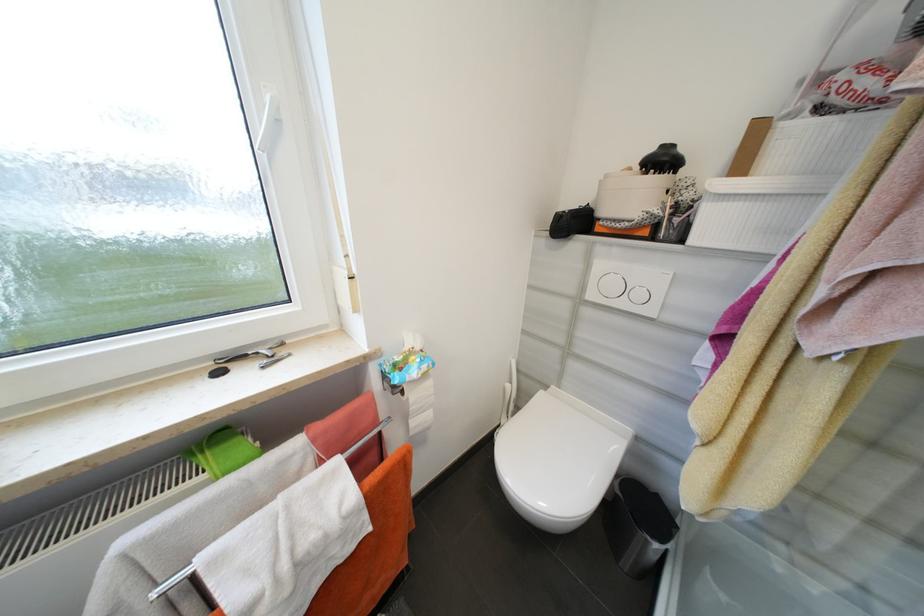
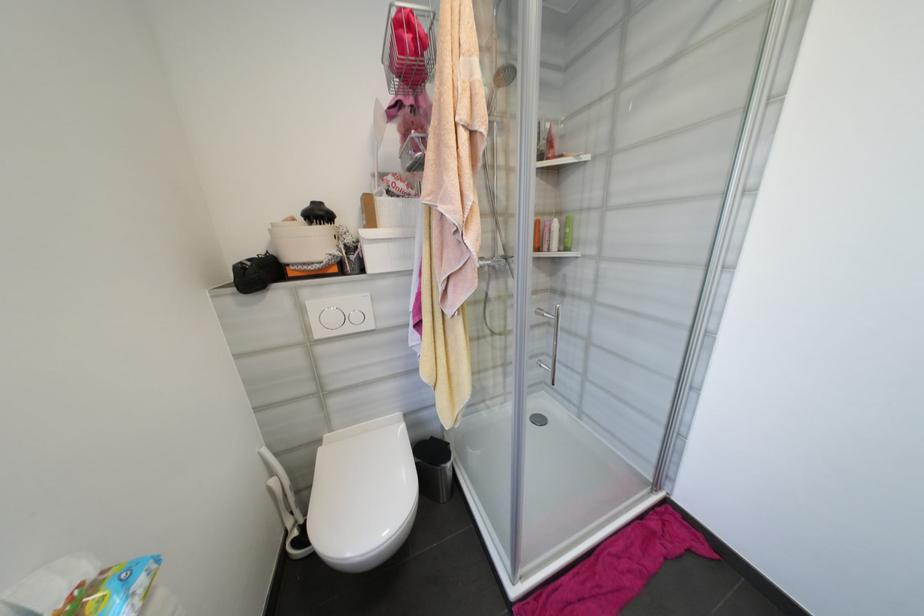
Where in the second image is the point corresponding to (646,296) from the first image?

(361, 318)